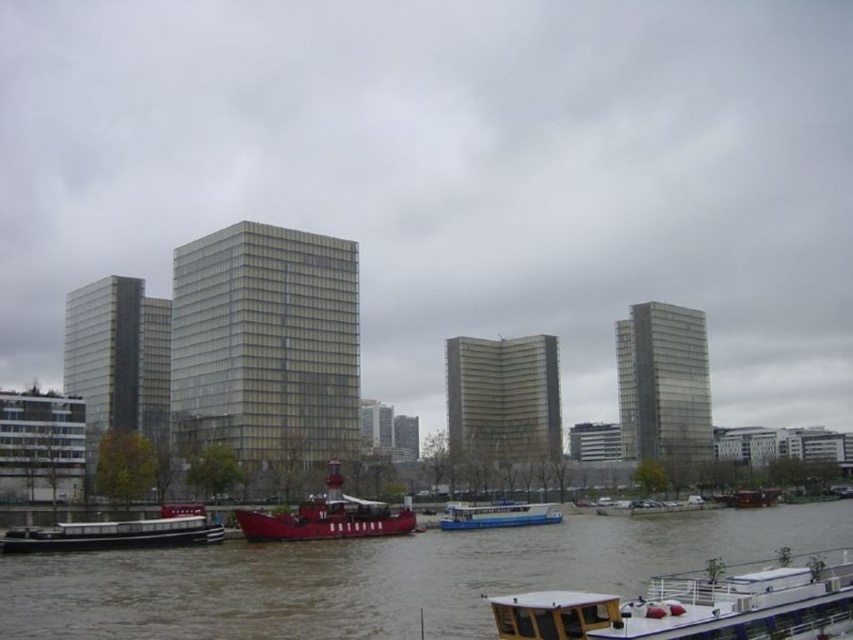
Is wooden deck boat at lower right shorter than matte black boat at lower left?

No.

Does wooden deck boat at lower right appear over matte black boat at lower left?

Yes, wooden deck boat at lower right is above matte black boat at lower left.

Identify the location of wooden deck boat at lower right. (695, 605).

Is point (189, 506) closer to viewer compared to point (503, 518)?

That is True.

Between matte black boat at lower left and white glossy boat at center, which one appears on the left side from the viewer's perspective?

Positioned to the left is matte black boat at lower left.

In order to click on matte black boat at lower left in this screenshot , I will do `click(117, 532)`.

Locate an element on the screen. matte black boat at lower left is located at coordinates (117, 532).

Is point (368, 608) positioned before point (90, 529)?

Yes, it is.

This screenshot has height=640, width=853. What do you see at coordinates (381, 577) in the screenshot?
I see `brown matte water at lower center` at bounding box center [381, 577].

Identify the location of brown matte water at lower center. This screenshot has width=853, height=640. (381, 577).